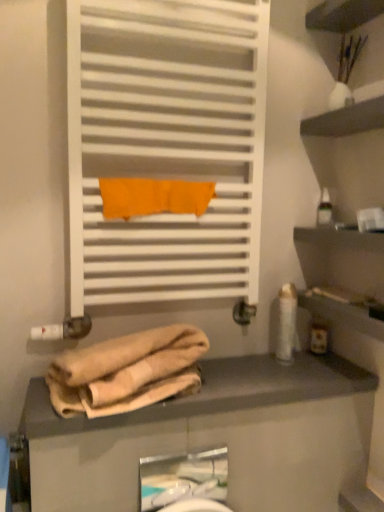
This screenshot has height=512, width=384. I want to click on vacant space situated on the left part of white glossy lotion at right, the 1th toiletry in the left-to-right sequence, so [240, 369].